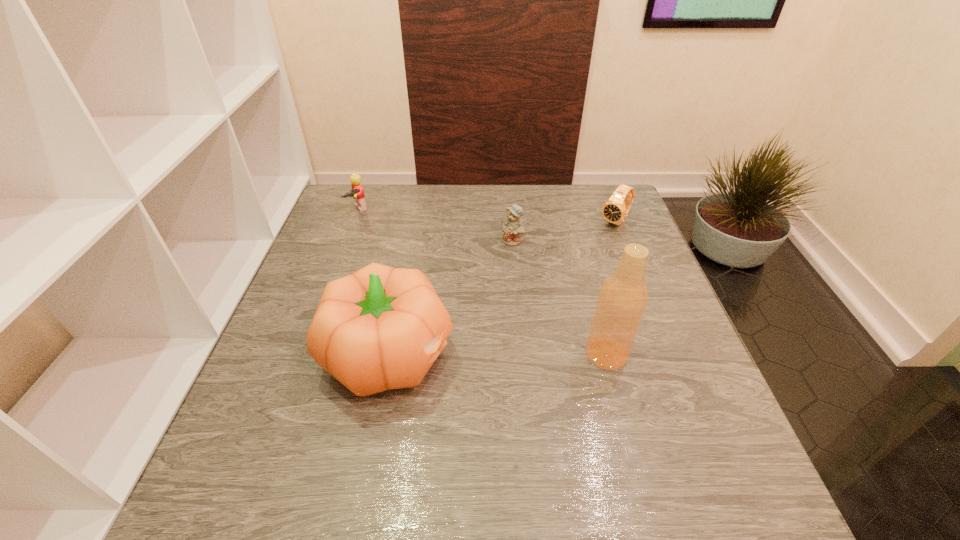
At what (x,y) coordinates should I click in order to perform the action: click on vacant region at the left edge of the desktop. Please return your answer as a coordinate pair (x, y). The image size is (960, 540). Looking at the image, I should click on (273, 401).

Where is `vacant space at the right edge of the desktop`? This screenshot has width=960, height=540. vacant space at the right edge of the desktop is located at coordinates (657, 395).

In the image, there is a desktop. At what (x,y) coordinates should I click in order to perform the action: click on vacant space at the far right corner. Please return your answer as a coordinate pair (x, y). This screenshot has width=960, height=540. Looking at the image, I should click on (636, 226).

The image size is (960, 540). I want to click on vacant area that lies between the beer bottle and the Lego, so click(x=482, y=282).

Image resolution: width=960 pixels, height=540 pixels. What are the coordinates of `free area in between the watch and the leftmost object` in the screenshot? It's located at (487, 216).

Find the location of a particular element. free space between the teddy bear and the rightmost object is located at coordinates (564, 231).

I want to click on vacant point located between the Lego and the teddy bear, so click(436, 225).

Identify the location of vacant space in between the second tallest object and the teddy bear. (451, 298).

Find the location of a particular element. The image size is (960, 540). free area in between the second object from right to left and the Lego is located at coordinates (482, 282).

The height and width of the screenshot is (540, 960). Identify the location of vacant space that is in between the fourth shortest object and the third object from left to right. (451, 298).